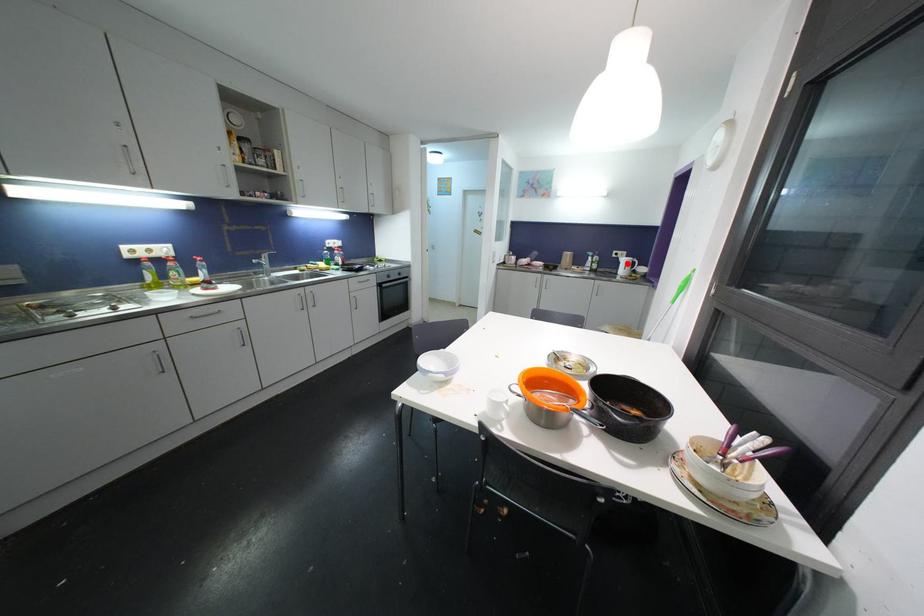
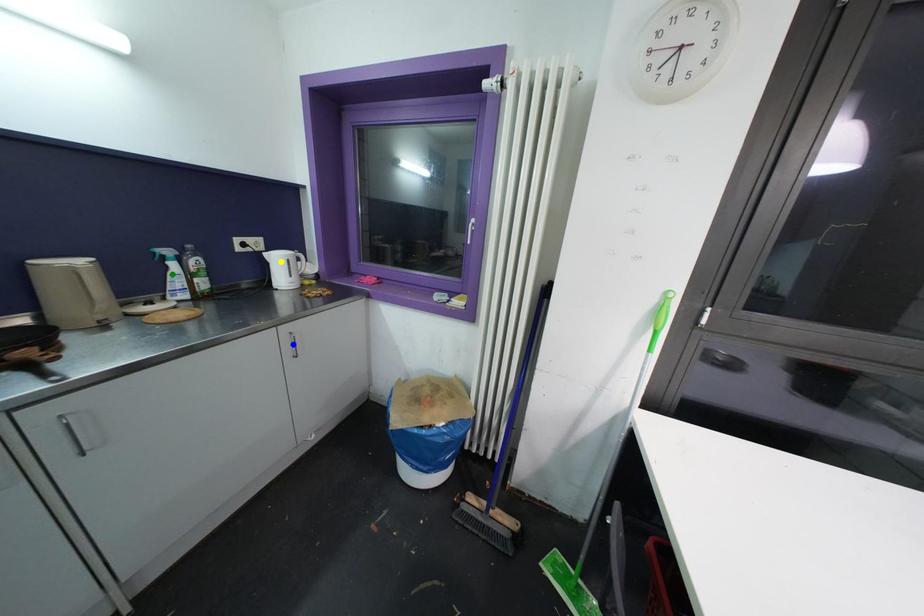
Question: I am providing you with two images of the same scene from different viewpoints. A red point is marked on the first image. You are given multiple points on the second image. Which spot in image 2 lines up with the point in image 1?

Choices:
 (A) green point
 (B) blue point
 (C) yellow point

Answer: (C)